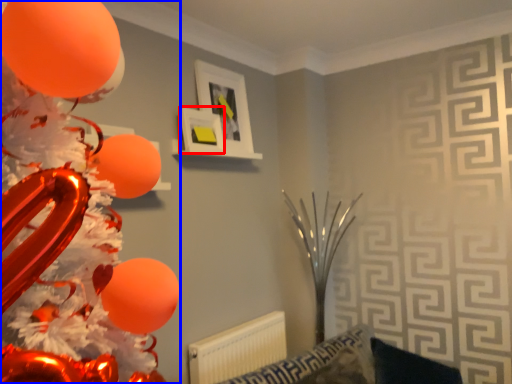
Question: Among these objects, which one is farthest to the camera, picture frame (highlighted by a red box) or balloon (highlighted by a blue box)?

Choices:
 (A) picture frame
 (B) balloon

Answer: (A)